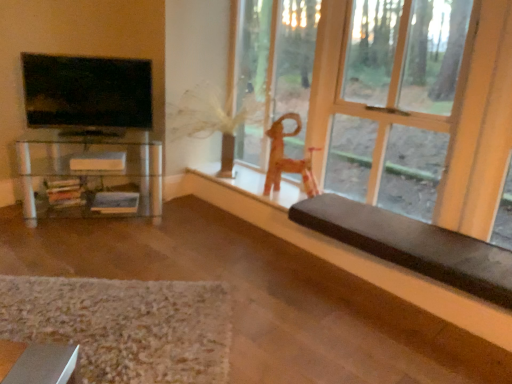
Question: Does textured beige rug at lower left have a lesser width compared to wooden chair at right?

Choices:
 (A) yes
 (B) no

Answer: (B)

Question: Is textured beige rug at lower left smaller than wooden chair at right?

Choices:
 (A) no
 (B) yes

Answer: (B)

Question: Can you confirm if textured beige rug at lower left is positioned to the left of wooden chair at right?

Choices:
 (A) no
 (B) yes

Answer: (B)

Question: Is textured beige rug at lower left completely or partially outside of wooden chair at right?

Choices:
 (A) no
 (B) yes

Answer: (B)

Question: Is textured beige rug at lower left facing towards wooden chair at right?

Choices:
 (A) no
 (B) yes

Answer: (A)

Question: Visually, is clear glass shelf at left positioned to the left or to the right of textured beige rug at lower left?

Choices:
 (A) left
 (B) right

Answer: (A)

Question: Looking at the image, does clear glass shelf at left seem bigger or smaller compared to textured beige rug at lower left?

Choices:
 (A) small
 (B) big

Answer: (B)

Question: Which is correct: clear glass shelf at left is inside textured beige rug at lower left, or outside of it?

Choices:
 (A) outside
 (B) inside

Answer: (A)

Question: Does point (38, 153) appear closer or farther from the camera than point (35, 317)?

Choices:
 (A) farther
 (B) closer

Answer: (A)

Question: Do you think wooden toy horse at center is within wooden chair at right, or outside of it?

Choices:
 (A) inside
 (B) outside

Answer: (B)

Question: From the image's perspective, is wooden toy horse at center positioned above or below wooden chair at right?

Choices:
 (A) above
 (B) below

Answer: (B)

Question: Is point (315, 192) positioned closer to the camera than point (458, 122)?

Choices:
 (A) farther
 (B) closer

Answer: (A)

Question: From a real-world perspective, relative to wooden chair at right, is wooden toy horse at center vertically above or below?

Choices:
 (A) below
 (B) above

Answer: (A)

Question: From the image's perspective, is wooden chair at right above or below textured beige rug at lower left?

Choices:
 (A) above
 (B) below

Answer: (A)

Question: Based on their sizes in the image, would you say wooden chair at right is bigger or smaller than textured beige rug at lower left?

Choices:
 (A) big
 (B) small

Answer: (A)